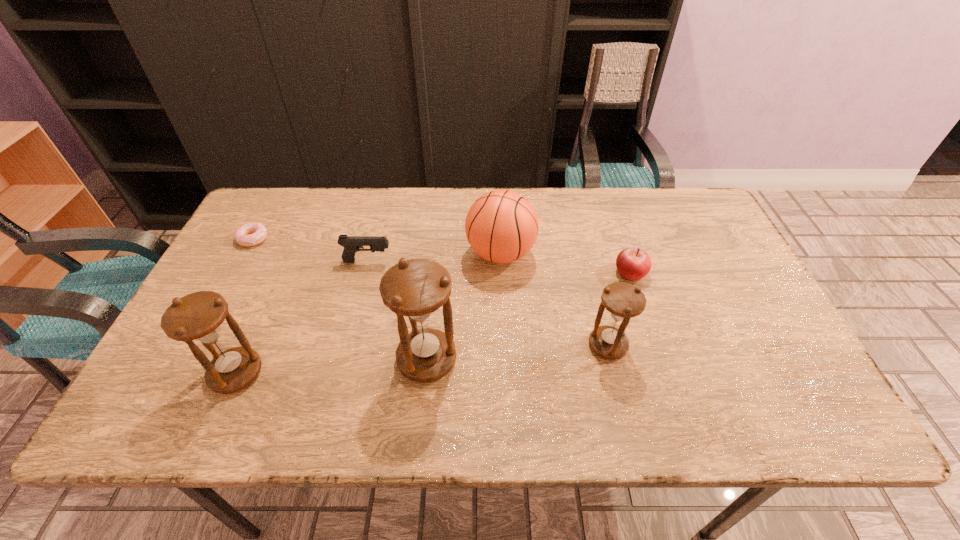
Locate an element on the screen. The image size is (960, 540). the sixth object from right to left is located at coordinates (198, 317).

This screenshot has width=960, height=540. Identify the location of the second shortest hourglass. (198, 317).

Where is `the second hourglass from left to right`? The width and height of the screenshot is (960, 540). the second hourglass from left to right is located at coordinates (415, 288).

This screenshot has height=540, width=960. What are the coordinates of `the tallest object` in the screenshot? It's located at (415, 288).

Identify the location of the sixth object from left to right. The width and height of the screenshot is (960, 540). [x=623, y=301].

This screenshot has height=540, width=960. What are the coordinates of `the shortest hourglass` in the screenshot? It's located at tap(623, 301).

You are a GUI agent. You are given a task and a screenshot of the screen. Output one action in this format:
    pyautogui.click(x=<x>, y=<y>)
    Task: Click on the doughnut
    The width and height of the screenshot is (960, 540).
    Given the screenshot: What is the action you would take?
    pyautogui.click(x=250, y=234)

Find the location of a particular element. The width and height of the screenshot is (960, 540). the shortest object is located at coordinates (250, 234).

Identify the location of apple. [633, 264].

You are a GUI agent. You are given a task and a screenshot of the screen. Output one action in this format:
    pyautogui.click(x=<x>, y=<y>)
    Task: Click on the third object from left to right
    This screenshot has height=540, width=960.
    Given the screenshot: What is the action you would take?
    click(352, 244)